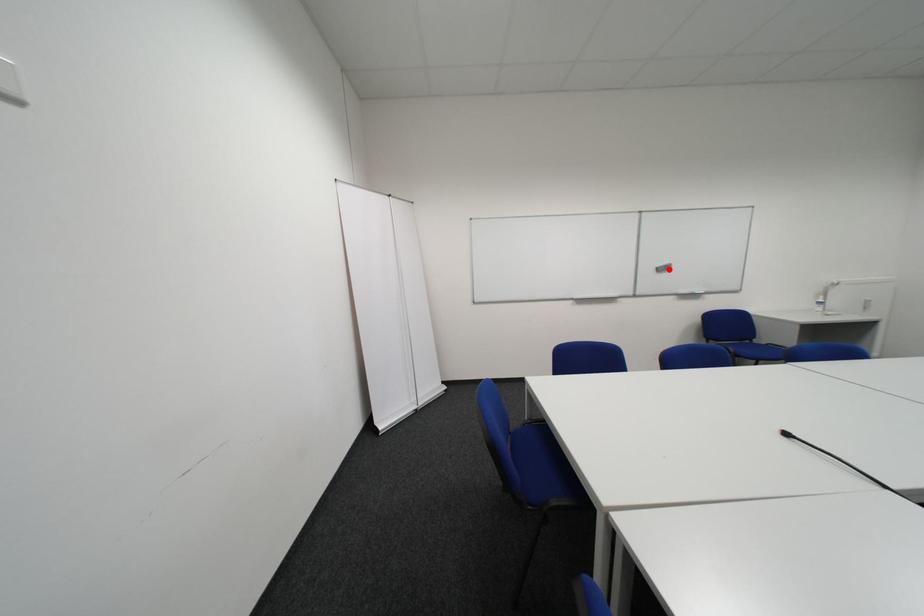
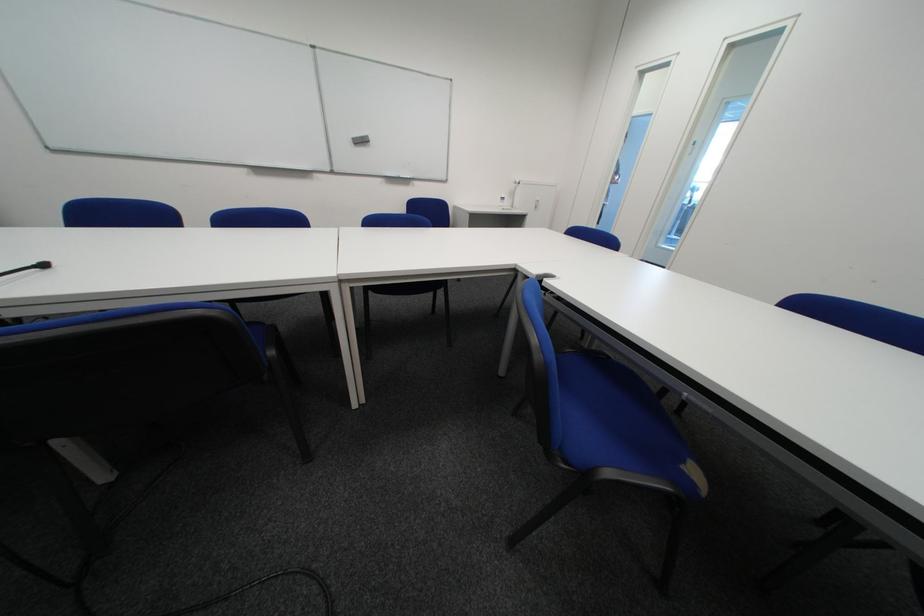
Find the pixel in the second image that matches the highlighted location in the first image.

(365, 140)